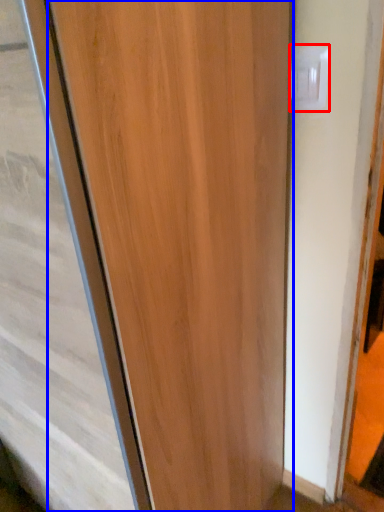
Question: Which object is further to the camera taking this photo, electric outlet (highlighted by a red box) or door (highlighted by a blue box)?

Choices:
 (A) electric outlet
 (B) door

Answer: (A)